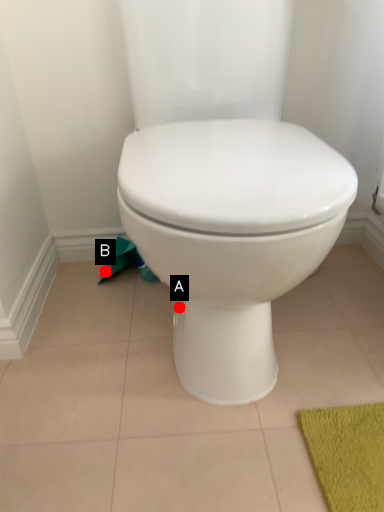
Question: Two points are circled on the image, labeled by A and B beside each circle. Which point appears closest to the camera in this image?

Choices:
 (A) A is closer
 (B) B is closer

Answer: (A)